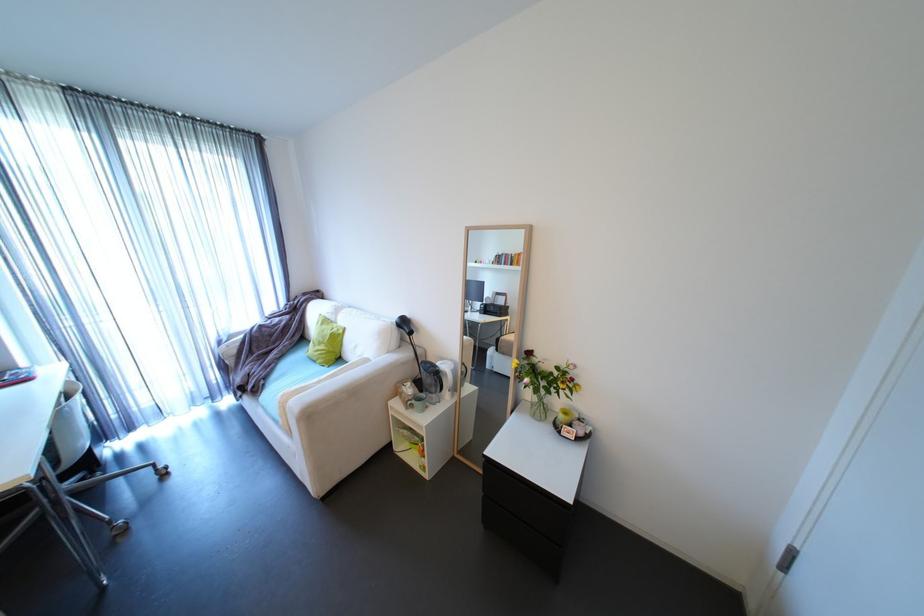
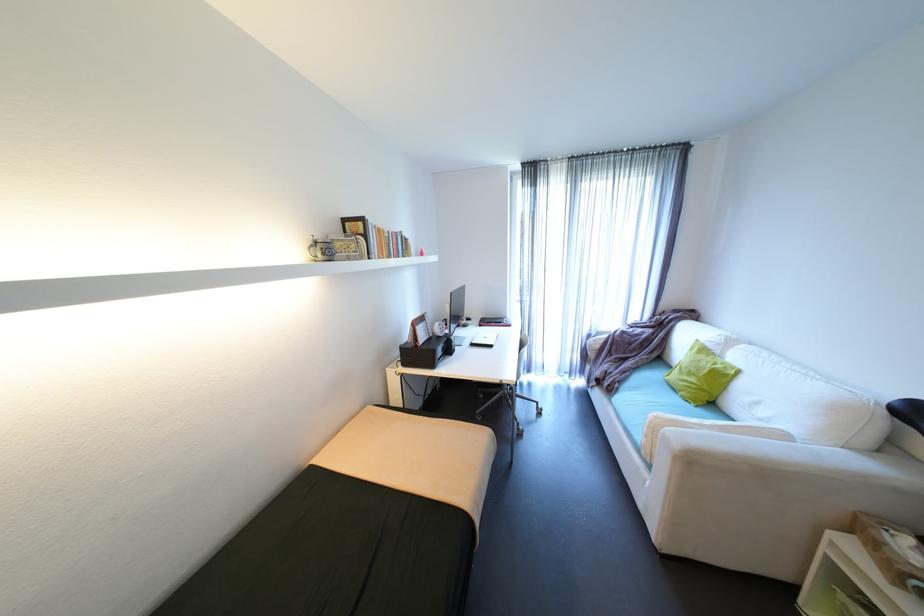
Question: How did the camera likely rotate?

Choices:
 (A) Left
 (B) Right
 (C) Up
 (D) Down

Answer: (A)